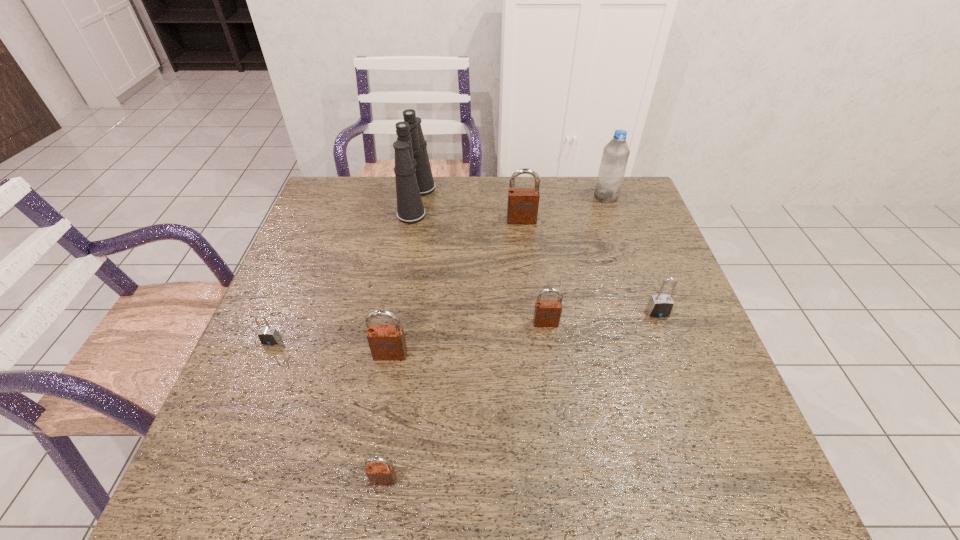
Find the location of `the fifth farthest object`. the fifth farthest object is located at coordinates (547, 313).

At what (x,y) coordinates should I click in order to perform the action: click on the left gray padlock. Please return your answer as a coordinate pair (x, y). The height and width of the screenshot is (540, 960). Looking at the image, I should click on point(268,335).

Identify the location of the leftmost object. This screenshot has height=540, width=960. (268, 335).

The height and width of the screenshot is (540, 960). I want to click on the nearest padlock, so click(379, 471).

This screenshot has width=960, height=540. Identify the location of the nearest object. (379, 471).

I want to click on free space located on the right of the binoculars, so click(553, 202).

You are a GUI agent. You are given a task and a screenshot of the screen. Output one action in this format:
    pyautogui.click(x=<x>, y=<y>)
    Task: Click on the vacant space situated on the left of the blue water bottle
    This screenshot has height=540, width=960.
    Given the screenshot: What is the action you would take?
    pyautogui.click(x=470, y=197)

At what (x,y) coordinates should I click in order to perform the action: click on free region located 0.180m on the front-facing side of the farthest padlock. Please return your answer as a coordinate pair (x, y). Looking at the image, I should click on (526, 266).

You are a GUI agent. You are given a task and a screenshot of the screen. Output one action in this format:
    pyautogui.click(x=<x>, y=<y>)
    Task: Click on the vacant space located 0.210m on the front-facing side of the seventh farthest object
    Image resolution: width=960 pixels, height=540 pixels.
    Given the screenshot: What is the action you would take?
    pyautogui.click(x=373, y=454)

Locate an element on the screen. The width and height of the screenshot is (960, 540). vacant region located on the shackle of the second farthest padlock is located at coordinates (677, 363).